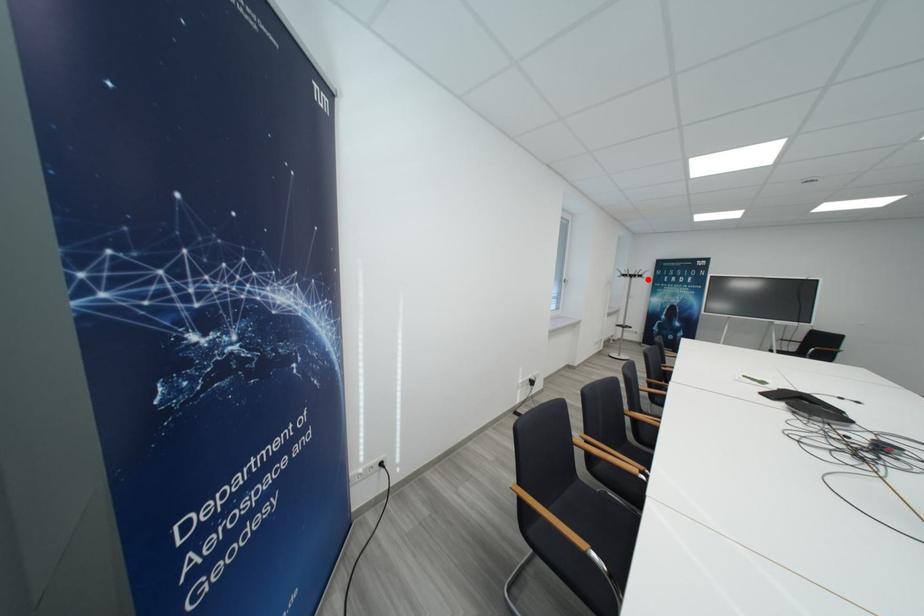
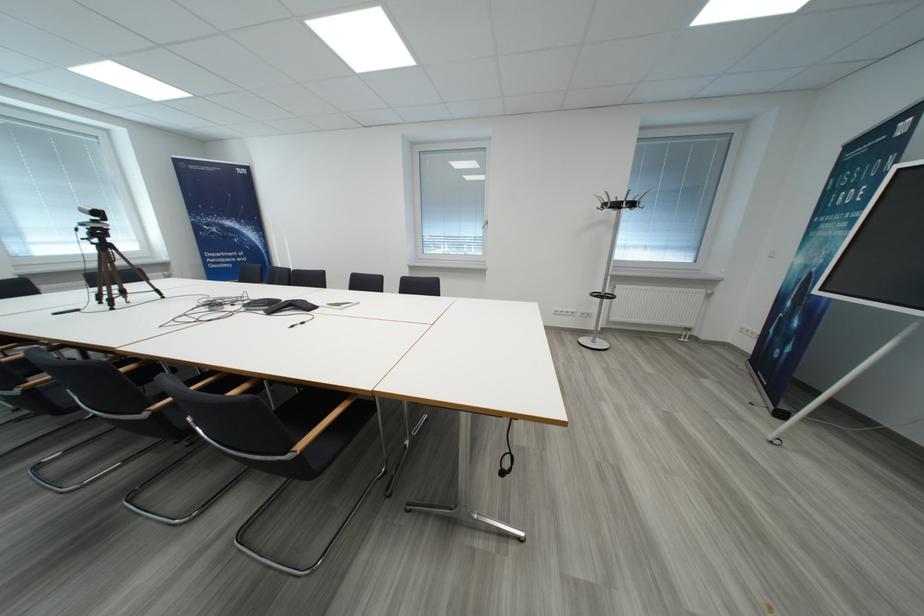
The point at the highlighted location is marked in the first image. Where is the corresponding point in the second image?

(623, 208)